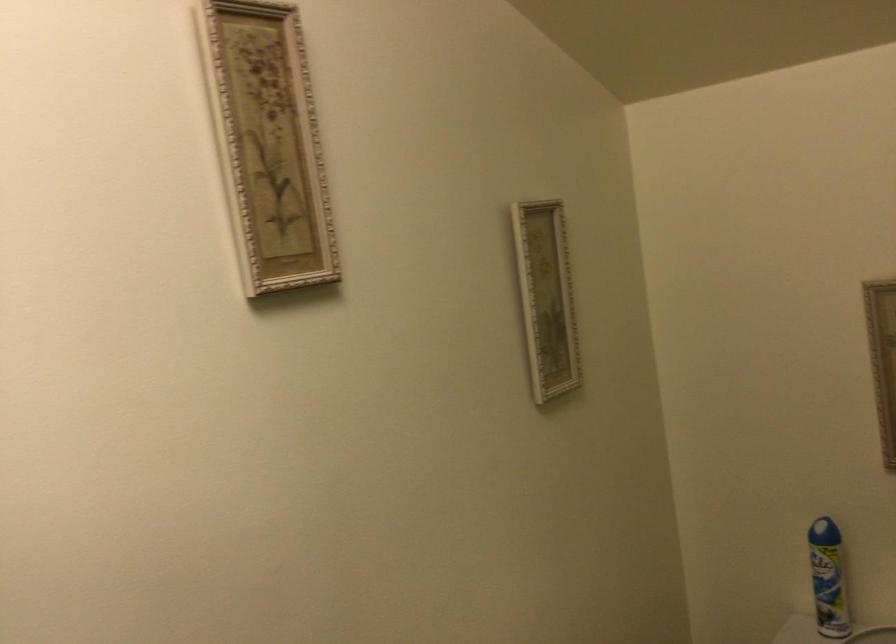
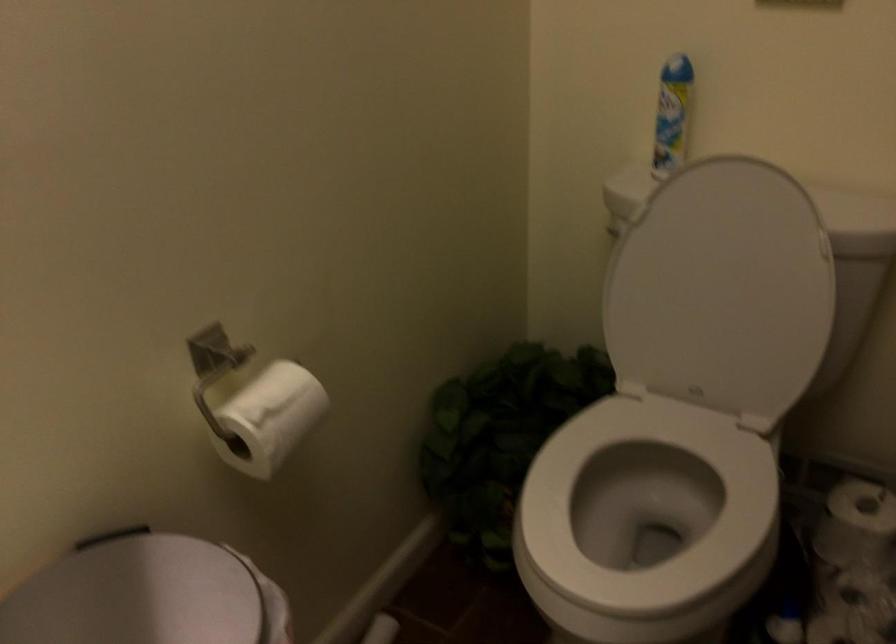
Consider the image. The images are taken continuously from a first-person perspective. In which direction are you moving?

The movement direction of the cameraman is right, forward.